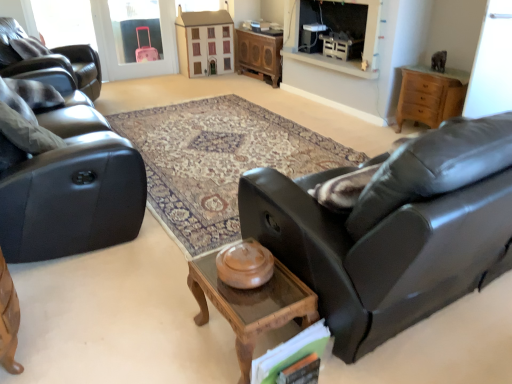
This screenshot has width=512, height=384. What do you see at coordinates (116, 50) in the screenshot?
I see `pink plastic suitcase at upper left` at bounding box center [116, 50].

What do you see at coordinates (382, 249) in the screenshot?
I see `matte black couch at right, the first studio couch when ordered from right to left` at bounding box center [382, 249].

This screenshot has width=512, height=384. Describe the element at coordinates (492, 64) in the screenshot. I see `transparent glass door at upper right` at that location.

At what (x,y) coordinates should I click in order to perform the action: click on matte black couch at left, the second studio couch in the right-to-left sequence. Please return your answer as a coordinate pair (x, y). This screenshot has height=384, width=512. Looking at the image, I should click on (72, 199).

Identify the location of wooden cabinet at center. Image resolution: width=512 pixels, height=384 pixels. (258, 55).

Considering the relative sizes of white plastic corded phone at upper center and wooden glass coffee table at center in the image provided, is white plastic corded phone at upper center thinner than wooden glass coffee table at center?

Yes, white plastic corded phone at upper center is thinner than wooden glass coffee table at center.

In the scene shown: From a real-world perspective, which is physically above, white plastic corded phone at upper center or wooden glass coffee table at center?

From a 3D spatial view, white plastic corded phone at upper center is above.

From the image's perspective, relative to wooden glass coffee table at center, is white plastic corded phone at upper center above or below?

white plastic corded phone at upper center is above wooden glass coffee table at center.

Is white plastic corded phone at upper center smaller than wooden glass coffee table at center?

Indeed, white plastic corded phone at upper center has a smaller size compared to wooden glass coffee table at center.

From a real-world perspective, does matte brown bowl at center stand above matte brown wooden dresser at upper center?

No, from a real-world perspective, matte brown bowl at center is not above matte brown wooden dresser at upper center.

Is matte brown bowl at center closer to the viewer compared to matte brown wooden dresser at upper center?

Yes, it is.

Is matte brown bowl at center taller or shorter than matte brown wooden dresser at upper center?

Clearly, matte brown bowl at center is shorter compared to matte brown wooden dresser at upper center.

You are a GUI agent. You are given a task and a screenshot of the screen. Output one action in this format:
    pyautogui.click(x=<x>, y=<y>)
    Task: Click on the dresser above the matte brown bowl at center (from the image's perspective)
    The height and width of the screenshot is (384, 512).
    Given the screenshot: What is the action you would take?
    pyautogui.click(x=204, y=42)

Based on the photo, is transparent glass door at upper right turned away from matte brown wooden dresser at upper center?

No, transparent glass door at upper right is not facing the opposite direction of matte brown wooden dresser at upper center.

The image size is (512, 384). In the image, there is a transparent glass door at upper right. Identify the location of dresser below it (from a real-world perspective). (204, 42).

Does transparent glass door at upper right lie behind matte brown wooden dresser at upper center?

No, it is not.

Is point (321, 57) closer or farther from the camera than point (75, 169)?

Point (321, 57) is farther from the camera than point (75, 169).

From the image's perspective, relative to matte black couch at left, the 1th studio couch from the left, is matte black fireplace at upper center above or below?

Based on their image positions, matte black fireplace at upper center is located above matte black couch at left, the 1th studio couch from the left.

Would you say matte black fireplace at upper center is inside or outside matte black couch at left, the 1th studio couch from the left?

matte black fireplace at upper center cannot be found inside matte black couch at left, the 1th studio couch from the left.

From a real-world perspective, is matte black fireplace at upper center beneath matte black couch at left, the 1th studio couch from the left?

No.

Is matte brown wooden dresser at upper center shorter than matte black couch at right, marked as the second studio couch in a left-to-right arrangement?

Yes.

Is matte brown wooden dresser at upper center inside the boundaries of matte black couch at right, marked as the second studio couch in a left-to-right arrangement, or outside?

matte brown wooden dresser at upper center lies outside matte black couch at right, marked as the second studio couch in a left-to-right arrangement.

Considering the positions of point (214, 50) and point (405, 301), is point (214, 50) closer or farther from the camera than point (405, 301)?

Clearly, point (214, 50) is more distant from the camera than point (405, 301).

From the image's perspective, is matte brown wooden dresser at upper center above or below matte black couch at right, the first studio couch when ordered from right to left?

Clearly, from the image's perspective, matte brown wooden dresser at upper center is above matte black couch at right, the first studio couch when ordered from right to left.

Between wooden cabinet at center and matte black recliner at left, which one has smaller size?

wooden cabinet at center is smaller.

How different are the orientations of wooden cabinet at center and matte black recliner at left in degrees?

150 degrees separate the facing orientations of wooden cabinet at center and matte black recliner at left.

From the image's perspective, which one is positioned higher, wooden cabinet at center or matte black recliner at left?

wooden cabinet at center is shown above in the image.

Which object is positioned more to the right, wooden cabinet at center or matte black recliner at left?

Positioned to the right is wooden cabinet at center.

From a real-world perspective, does white plastic corded phone at upper center sit lower than matte black couch at left, the second studio couch in the right-to-left sequence?

Actually, white plastic corded phone at upper center is physically above matte black couch at left, the second studio couch in the right-to-left sequence, in the real world.

Can you confirm if white plastic corded phone at upper center is bigger than matte black couch at left, the 1th studio couch from the left?

No, white plastic corded phone at upper center is not bigger than matte black couch at left, the 1th studio couch from the left.

Which is nearer, (x=310, y=51) or (x=129, y=154)?

Point (x=310, y=51).

Is white plastic corded phone at upper center facing away from matte black couch at left, the second studio couch in the right-to-left sequence?

No, white plastic corded phone at upper center's orientation is not away from matte black couch at left, the second studio couch in the right-to-left sequence.

Image resolution: width=512 pixels, height=384 pixels. What are the coordinates of `corded phone behind the wooden glass coffee table at center` in the screenshot? It's located at (311, 37).

Image resolution: width=512 pixels, height=384 pixels. Identify the location of plain below the matte brown wooden dresser at upper center (from the image's perspective). (217, 161).

Estimate the real-world distances between objects in this image. Which object is closer to white plastic corded phone at upper center, transparent glass door at upper right or matte black couch at right, the first studio couch when ordered from right to left?

Based on the image, transparent glass door at upper right appears to be nearer to white plastic corded phone at upper center.

When comparing their distances from matte brown bowl at center, does wooden glass coffee table at center or wooden cabinet at right seem closer?

wooden cabinet at right.

Based on the photo, estimate the real-world distances between objects in this image. Which object is further from matte black couch at right, marked as the second studio couch in a left-to-right arrangement, matte black couch at left, the 1th studio couch from the left, or wooden glass coffee table at center?

Based on the image, matte black couch at left, the 1th studio couch from the left, appears to be further to matte black couch at right, marked as the second studio couch in a left-to-right arrangement.

Which object lies further to the anchor point wooden cabinet at right, matte black couch at left, the second studio couch in the right-to-left sequence, or wooden glass coffee table at center?

matte black couch at left, the second studio couch in the right-to-left sequence, is positioned further to the anchor wooden cabinet at right.

Based on their spatial positions, is matte brown bowl at center or matte black fireplace at upper center closer to matte black couch at right, the first studio couch when ordered from right to left?

matte brown bowl at center is positioned closer to the anchor matte black couch at right, the first studio couch when ordered from right to left.

Looking at the image, which one is located further to wooden glass coffee table at center, matte black fireplace at upper center or pink plastic suitcase at upper left?

Based on the image, pink plastic suitcase at upper left appears to be further to wooden glass coffee table at center.

Looking at the image, which one is located closer to matte black fireplace at upper center, transparent glass door at upper right or white plastic corded phone at upper center?

Based on the image, white plastic corded phone at upper center appears to be nearer to matte black fireplace at upper center.

Which object lies further to the anchor point wooden glass coffee table at center, white plastic corded phone at upper center or matte black couch at right, marked as the second studio couch in a left-to-right arrangement?

white plastic corded phone at upper center is further to wooden glass coffee table at center.

I want to click on corded phone between matte brown wooden dresser at upper center and wooden cabinet at right in the horizontal direction, so click(311, 37).

Locate an element on the screen. The height and width of the screenshot is (384, 512). plain between matte black recliner at left and matte black fireplace at upper center from left to right is located at coordinates (217, 161).

This screenshot has width=512, height=384. Find the location of `studio couch located between matte brown bowl at center and transparent glass door at upper right in the left-right direction`. studio couch located between matte brown bowl at center and transparent glass door at upper right in the left-right direction is located at coordinates coord(382,249).

Locate an element on the screen. The width and height of the screenshot is (512, 384). corded phone between matte black fireplace at upper center and wooden cabinet at center along the z-axis is located at coordinates (311, 37).